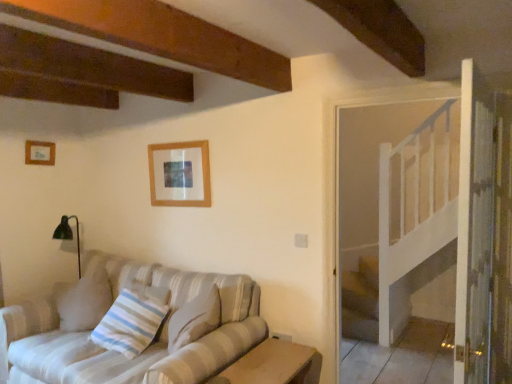
Locate an element on the screen. Image resolution: width=512 pixels, height=384 pixels. vacant point above wooden table at lower center (from a real-world perspective) is located at coordinates (265, 365).